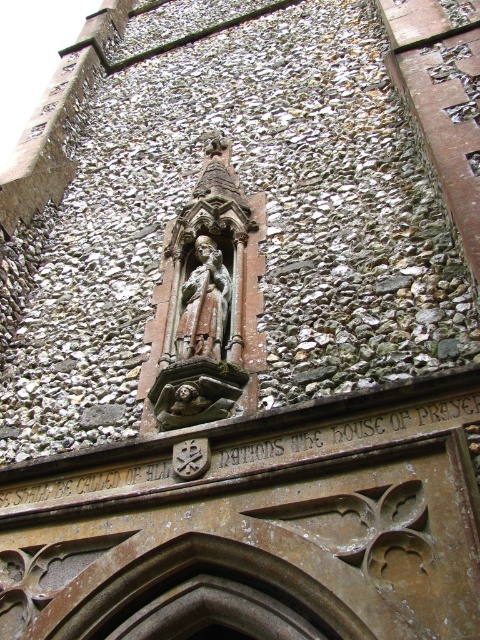
Question: Which point is farther to the camera?

Choices:
 (A) brown stone gargoyle at center
 (B) carved stone statue at center

Answer: (B)

Question: Among these points, which one is nearest to the camera?

Choices:
 (A) (189, 337)
 (B) (189, 400)

Answer: (B)

Question: Considering the relative positions of carved stone statue at center and brown stone gargoyle at center in the image provided, where is carved stone statue at center located with respect to brown stone gargoyle at center?

Choices:
 (A) above
 (B) below

Answer: (A)

Question: Which of the following is the farthest from the observer?

Choices:
 (A) (201, 312)
 (B) (188, 378)

Answer: (A)

Question: Does carved stone statue at center appear under brown stone gargoyle at center?

Choices:
 (A) no
 (B) yes

Answer: (A)

Question: Is carved stone statue at center thinner than brown stone gargoyle at center?

Choices:
 (A) yes
 (B) no

Answer: (B)